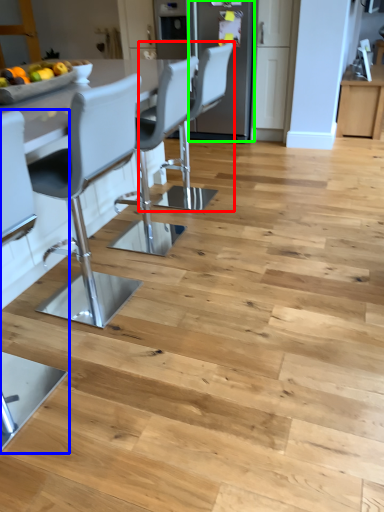
Question: Which is nearer to the chair (highlighted by a red box)? chair (highlighted by a blue box) or appliance (highlighted by a green box).

Choices:
 (A) chair
 (B) appliance

Answer: (B)